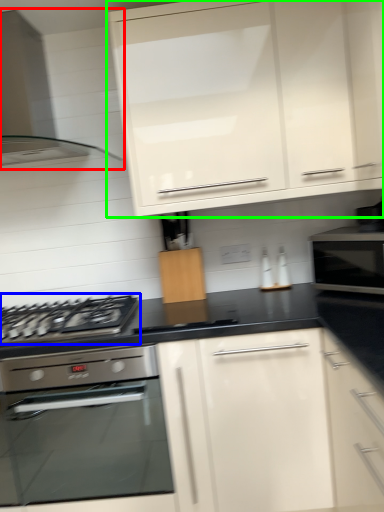
Question: Considering the real-world distances, which object is closest to home appliance (highlighted by a red box)? gas stove (highlighted by a blue box) or cabinetry (highlighted by a green box).

Choices:
 (A) gas stove
 (B) cabinetry

Answer: (B)